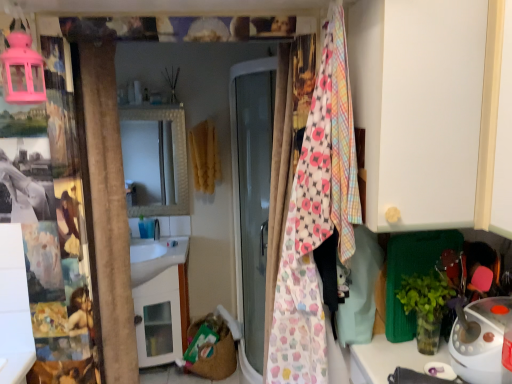
At what (x,y) coordinates should I click in order to perform the action: click on white plastic iron at lower right. Please return your answer as a coordinate pair (x, y). The height and width of the screenshot is (384, 512). Looking at the image, I should click on (483, 341).

Measure the distance between white plastic iron at lower right and camera.

They are 3.45 feet apart.

What do you see at coordinates (483, 341) in the screenshot? I see `white plastic iron at lower right` at bounding box center [483, 341].

This screenshot has width=512, height=384. I want to click on cupcake-patterned fabric at center, so click(316, 218).

In order to face cupcake-patterned fabric at center, should I rotate leftwards or rightwards?

To align with it, rotate right about 6.408°.

Describe the element at coordinates (316, 218) in the screenshot. I see `cupcake-patterned fabric at center` at that location.

In order to click on white plastic iron at lower right in this screenshot , I will do `click(483, 341)`.

Visually, is white plastic iron at lower right positioned to the left or to the right of cupcake-patterned fabric at center?

From the image, it's evident that white plastic iron at lower right is to the right of cupcake-patterned fabric at center.

Which object is further away from the camera, white plastic iron at lower right or cupcake-patterned fabric at center?

white plastic iron at lower right is more distant.

Which point is more forward, (503, 312) or (339, 175)?

The point (503, 312) is more forward.

From the image's perspective, is white plastic iron at lower right over cupcake-patterned fabric at center?

No, from the image's perspective, white plastic iron at lower right is not on top of cupcake-patterned fabric at center.

From a real-world perspective, is white plastic iron at lower right physically above cupcake-patterned fabric at center?

No, from a real-world perspective, white plastic iron at lower right is not over cupcake-patterned fabric at center

Which of these two, white plastic iron at lower right or cupcake-patterned fabric at center, is wider?

Wider between the two is cupcake-patterned fabric at center.

From the picture: Considering the sizes of objects white plastic iron at lower right and cupcake-patterned fabric at center in the image provided, who is shorter, white plastic iron at lower right or cupcake-patterned fabric at center?

Standing shorter between the two is white plastic iron at lower right.

Considering the relative sizes of white plastic iron at lower right and cupcake-patterned fabric at center in the image provided, is white plastic iron at lower right smaller than cupcake-patterned fabric at center?

Yes.

Is white plastic iron at lower right not inside cupcake-patterned fabric at center?

That's correct, white plastic iron at lower right is outside of cupcake-patterned fabric at center.

In the scene shown: Is white plastic iron at lower right next to cupcake-patterned fabric at center?

No, white plastic iron at lower right is not next to cupcake-patterned fabric at center.

Is white plastic iron at lower right facing towards cupcake-patterned fabric at center?

No, white plastic iron at lower right is not oriented towards cupcake-patterned fabric at center.

How different are the orientations of white plastic iron at lower right and cupcake-patterned fabric at center in degrees?

The facing directions of white plastic iron at lower right and cupcake-patterned fabric at center are 0.612 degrees apart.

Locate an element on the screen. blanket above the white plastic iron at lower right (from the image's perspective) is located at coordinates (316, 218).

Considering the relative positions of cupcake-patterned fabric at center and white plastic iron at lower right in the image provided, is cupcake-patterned fabric at center to the right of white plastic iron at lower right from the viewer's perspective?

Incorrect, cupcake-patterned fabric at center is not on the right side of white plastic iron at lower right.

Is cupcake-patterned fabric at center in front of or behind white plastic iron at lower right in the image?

Visually, cupcake-patterned fabric at center is located in front of white plastic iron at lower right.

Between point (340, 47) and point (490, 320), which one is positioned behind?

The point (340, 47) is farther.

From the image's perspective, is cupcake-patterned fabric at center positioned above or below white plastic iron at lower right?

Clearly, from the image's perspective, cupcake-patterned fabric at center is above white plastic iron at lower right.

From a real-world perspective, between cupcake-patterned fabric at center and white plastic iron at lower right, who is vertically higher?

cupcake-patterned fabric at center, from a real-world perspective.

Considering the sizes of objects cupcake-patterned fabric at center and white plastic iron at lower right in the image provided, who is wider, cupcake-patterned fabric at center or white plastic iron at lower right?

With larger width is cupcake-patterned fabric at center.

Can you confirm if cupcake-patterned fabric at center is shorter than white plastic iron at lower right?

Incorrect, the height of cupcake-patterned fabric at center does not fall short of that of white plastic iron at lower right.

Is cupcake-patterned fabric at center smaller than white plastic iron at lower right?

No, cupcake-patterned fabric at center is not smaller than white plastic iron at lower right.

Is white plastic iron at lower right inside cupcake-patterned fabric at center?

No.

Is cupcake-patterned fabric at center beside white plastic iron at lower right?

cupcake-patterned fabric at center and white plastic iron at lower right are not in contact.

Is cupcake-patterned fabric at center facing towards white plastic iron at lower right?

No, cupcake-patterned fabric at center is not aimed at white plastic iron at lower right.

How many degrees apart are the facing directions of cupcake-patterned fabric at center and white plastic iron at lower right?

The angular difference between cupcake-patterned fabric at center and white plastic iron at lower right is 0.612 degrees.

In order to click on blanket in front of the white plastic iron at lower right in this screenshot , I will do `click(316, 218)`.

Locate an element on the screen. This screenshot has width=512, height=384. appliance below the cupcake-patterned fabric at center (from the image's perspective) is located at coordinates (483, 341).

I want to click on blanket in front of the white plastic iron at lower right, so click(x=316, y=218).